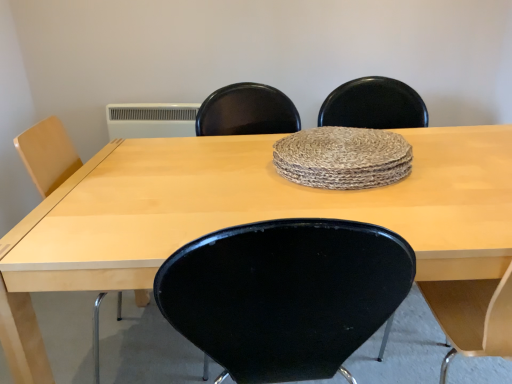
The height and width of the screenshot is (384, 512). I want to click on vacant area that lies to the right of natural fiber placemat at center, so click(x=459, y=168).